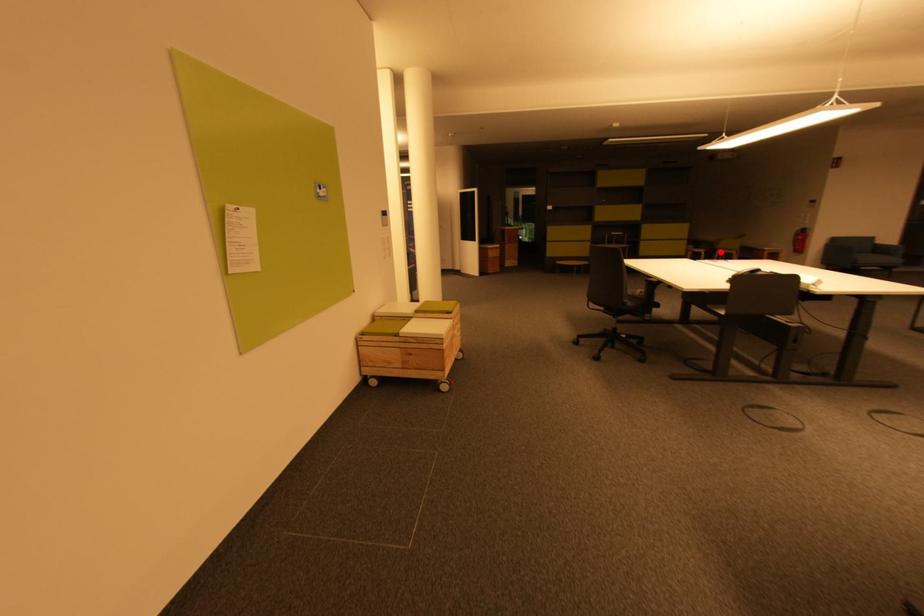
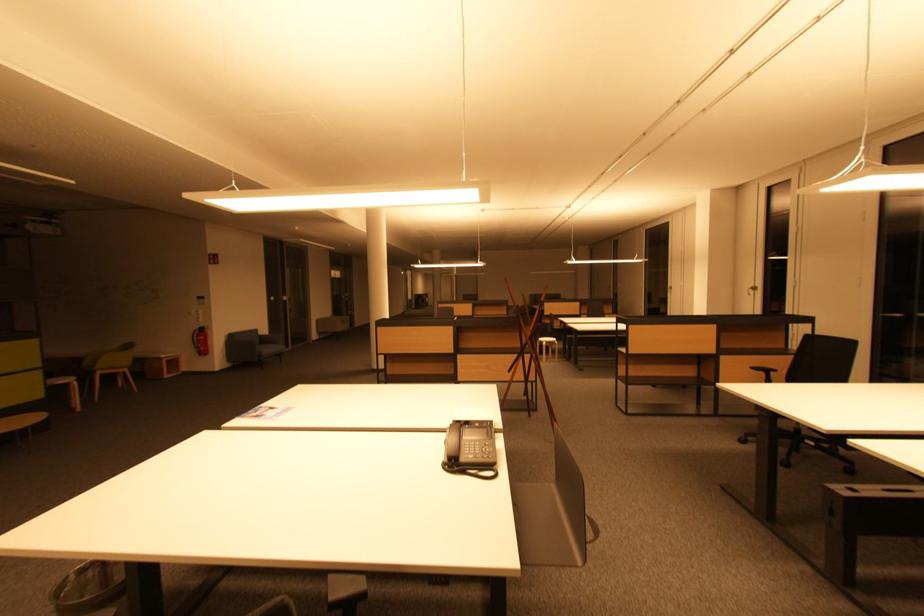
Question: I am providing you with two images of the same scene from different viewpoints. A red point is shown in image1. For the corresponding object point in image2, is it positioned nearer or farther from the camera?

Choices:
 (A) Nearer
 (B) Farther

Answer: (B)